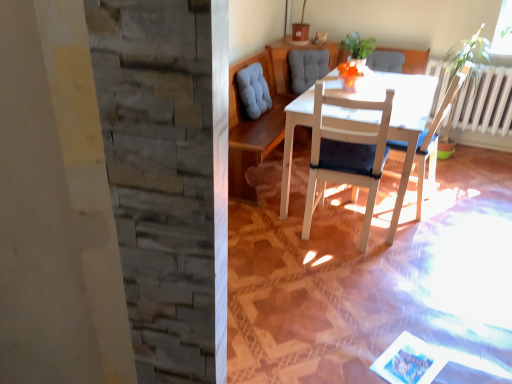
You are a GUI agent. You are given a task and a screenshot of the screen. Output one action in this format:
    pyautogui.click(x=<x>, y=<y>)
    Task: Click on the vacant area in front of white wood chair at center, placed as the second chair when sorted from right to left
    The height and width of the screenshot is (384, 512).
    Given the screenshot: What is the action you would take?
    pyautogui.click(x=358, y=278)